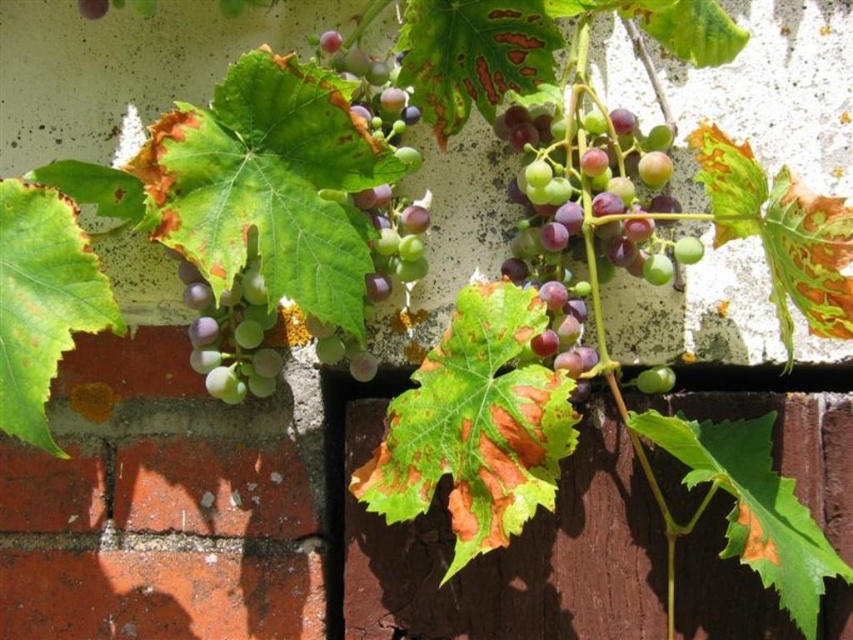
You are holding a gardening tool that has a maximum reach of 80 centimeters. You need to prune the green matte grapes at upper center. Can you reach them with your current tool?

The green matte grapes at upper center are 92.65 centimeters away from the viewer, which is beyond the 80 centimeter reach of the gardening tool. You cannot reach them with your current tool.

You are an artist painting a still life of the green matte grapes at upper center and the green matte grape at center. Which of these two grapes should you paint larger in terms of width?

You should paint the green matte grapes at upper center larger in width because its width is larger than the green matte grape at center.